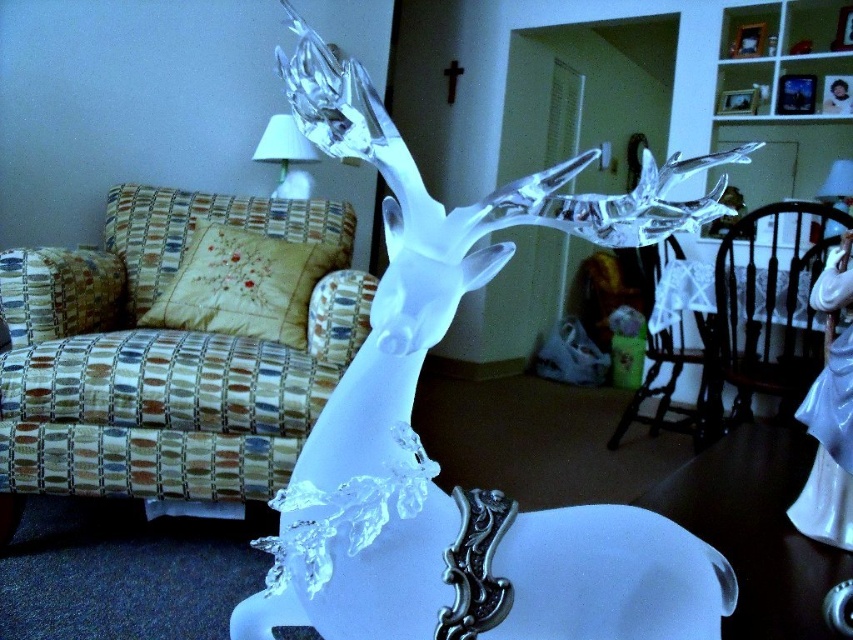
Between point (425, 561) and point (273, 157), which one is positioned behind?

Point (273, 157)

What do you see at coordinates (434, 461) in the screenshot? The height and width of the screenshot is (640, 853). I see `white frosted glass deer at center` at bounding box center [434, 461].

Find the location of `white frosted glass deer at center`. white frosted glass deer at center is located at coordinates (434, 461).